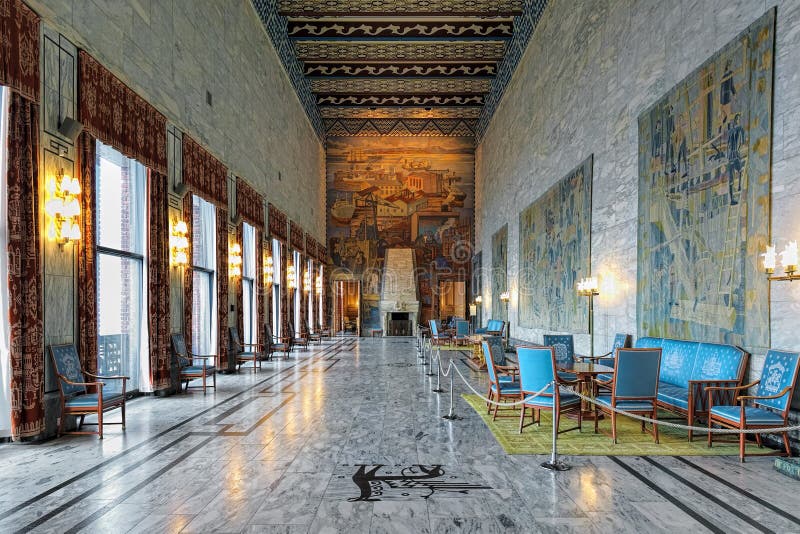
Identify the location of blue upholstered wood bench. (688, 363).